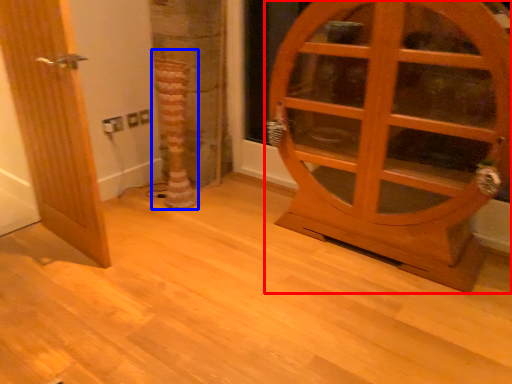
Question: Which of the following is the farthest to the observer, door (highlighted by a red box) or tree trunk (highlighted by a blue box)?

Choices:
 (A) door
 (B) tree trunk

Answer: (B)